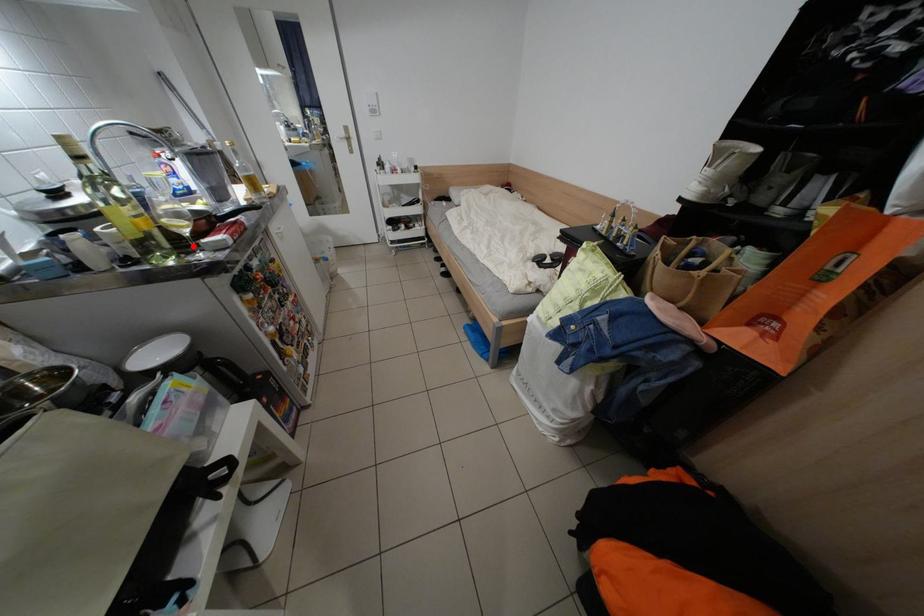
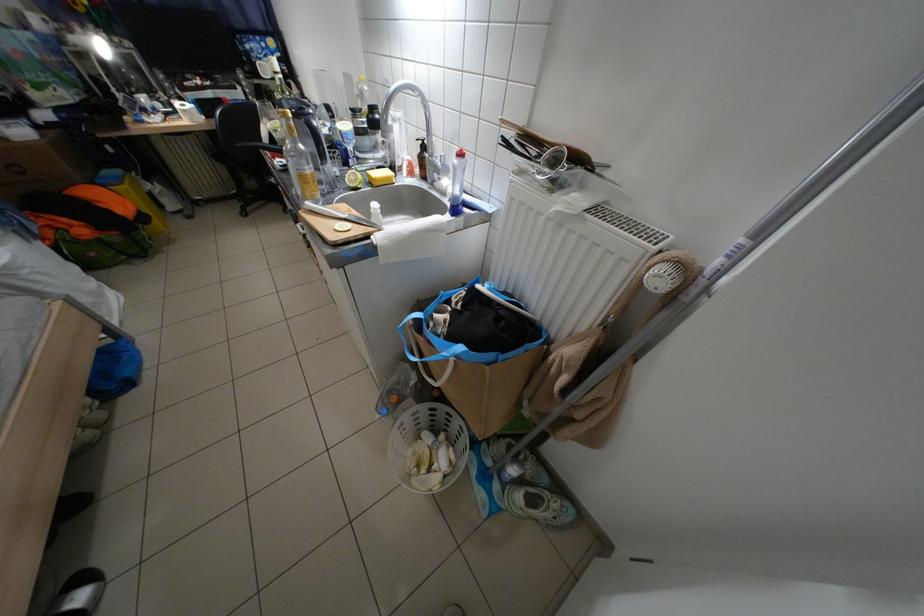
Question: I am providing you with two images of the same scene from different viewpoints. A red point is marked on the first image. Is the red point's position out of view in image 2?

Choices:
 (A) Yes
 (B) No

Answer: (A)